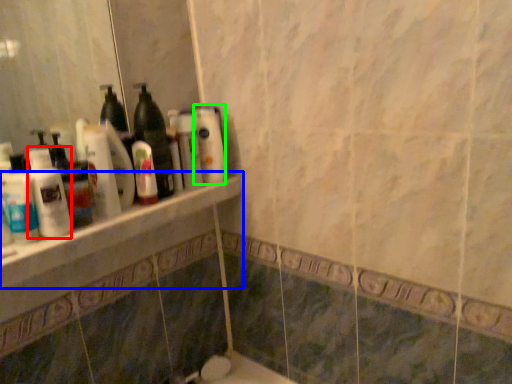
Question: Considering the real-world distances, which object is closest to cleaning product (highlighted by a red box)? ledge (highlighted by a blue box) or cleaning product (highlighted by a green box).

Choices:
 (A) ledge
 (B) cleaning product

Answer: (A)